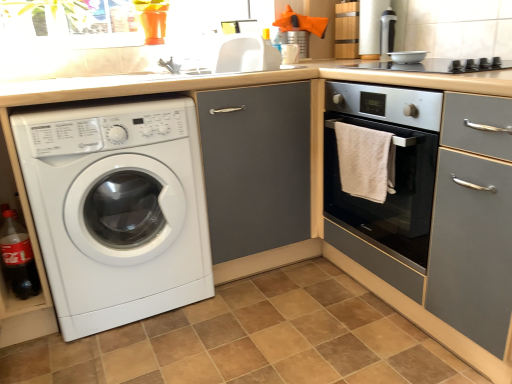
Image resolution: width=512 pixels, height=384 pixels. I want to click on vacant area on top of silver metallic bowl at upper center, the second appliance when ordered from top to bottom (from a real-world perspective), so click(x=408, y=55).